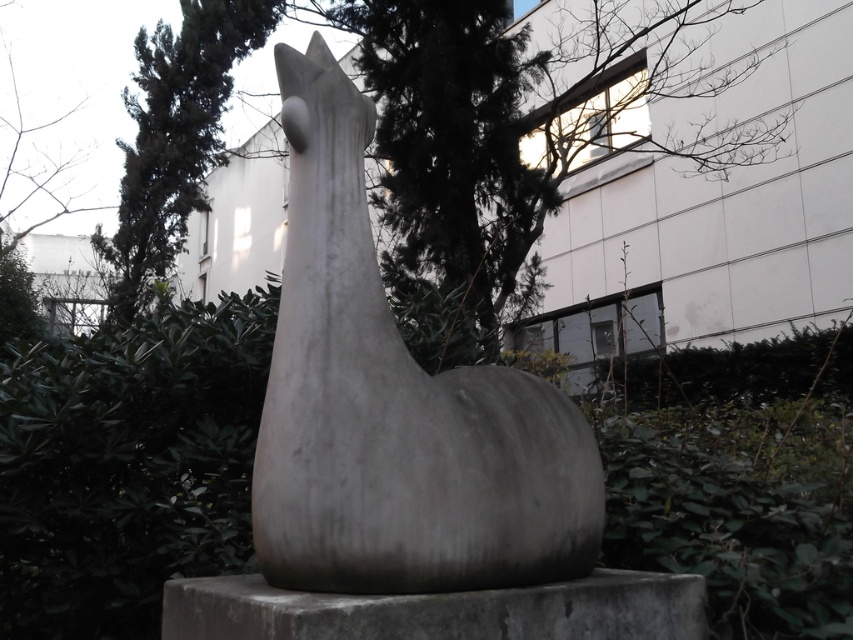
You are an artist planning to paint this sculpture scene. You need to decide which object to focus on first based on their sizes. Which object is narrower between the gray concrete at center and the green leafy tree at upper center?

The gray concrete at center is narrower than the green leafy tree at upper center, so you should focus on painting the gray concrete at center first if you want to start with the narrower object.

You are standing in front of the sculpture and want to take a photo of both the green leafy tree at center and the gray concrete at center. Which object should you focus on first to ensure both are in focus?

You should focus on the gray concrete at center first because it is closer to you than the green leafy tree at center, which is further away. By focusing on the closer object, you can ensure both are in focus using the depth of field.

You are standing in front of the sculpture and want to take a photo that includes both the green leafy tree at center and the green leafy tree at upper center. Which tree should you position closer to the front of your camera frame to ensure both are visible?

You should position the green leafy tree at center closer to the front of your camera frame because it is closer to the viewer than the green leafy tree at upper center, ensuring both are visible in the photo.